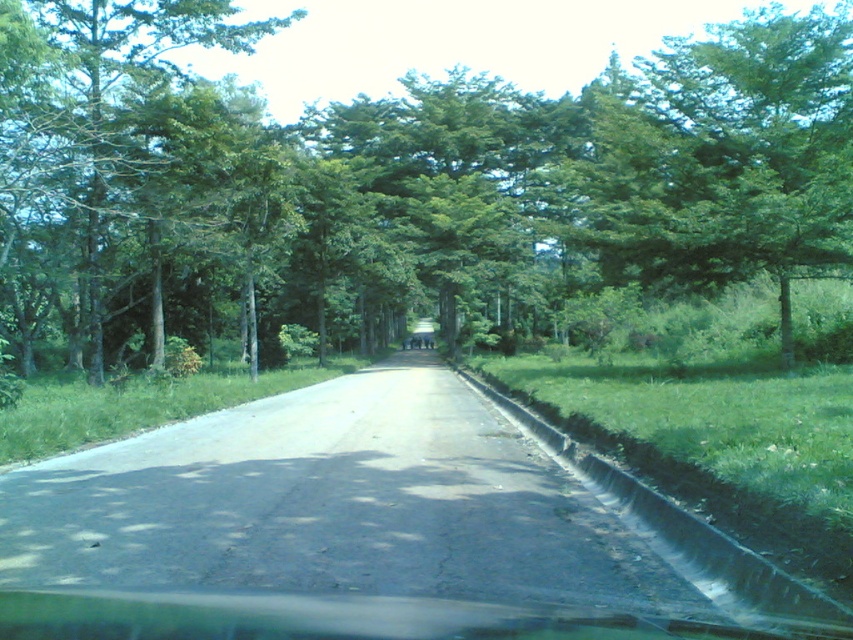
From the picture: You are driving a car and notice two green leafy trees ahead on the road. The green leafy tree at center and the green leafy tree at left. Which tree would appear closer to you based on their sizes?

The green leafy tree at center is bigger than the green leafy tree at left, so the green leafy tree at center would appear closer to you since larger objects in the distance usually indicate they are nearer.

You are driving along the rural road and want to stay in the middle of the road. There is a green leafy tree at center located at point (398, 186). Where should you steer to keep centered?

To stay centered on the road, you should steer towards the green leafy tree at center located at point (398, 186) because it marks the center of the road.